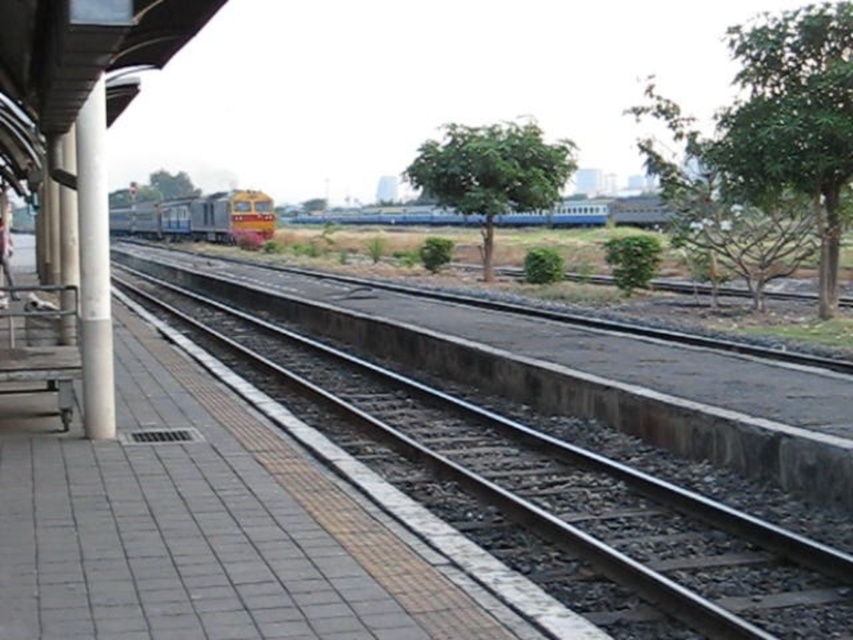
Is gray concrete platform at center positioned in front of white concrete pillar at left?

No.

Does gray concrete platform at center have a lesser width compared to white concrete pillar at left?

Correct, gray concrete platform at center's width is less than white concrete pillar at left's.

Is point (247, 563) positioned before point (107, 232)?

Yes.

This screenshot has height=640, width=853. I want to click on gray concrete platform at center, so click(x=206, y=528).

Is white concrete pillar at left to the left of white fabric pants at left from the viewer's perspective?

Incorrect, white concrete pillar at left is not on the left side of white fabric pants at left.

Can you confirm if white concrete pillar at left is positioned below white fabric pants at left?

Indeed, white concrete pillar at left is positioned under white fabric pants at left.

The width and height of the screenshot is (853, 640). What are the coordinates of `white concrete pillar at left` in the screenshot? It's located at (93, 268).

Between gray concrete platform at center and yellow metallic train at center, which one is positioned higher?

yellow metallic train at center is higher up.

Consider the image. Measure the distance between gray concrete platform at center and yellow metallic train at center.

gray concrete platform at center and yellow metallic train at center are 63.65 meters apart.

What do you see at coordinates (206, 528) in the screenshot?
I see `gray concrete platform at center` at bounding box center [206, 528].

The image size is (853, 640). Find the location of `gray concrete platform at center`. gray concrete platform at center is located at coordinates (206, 528).